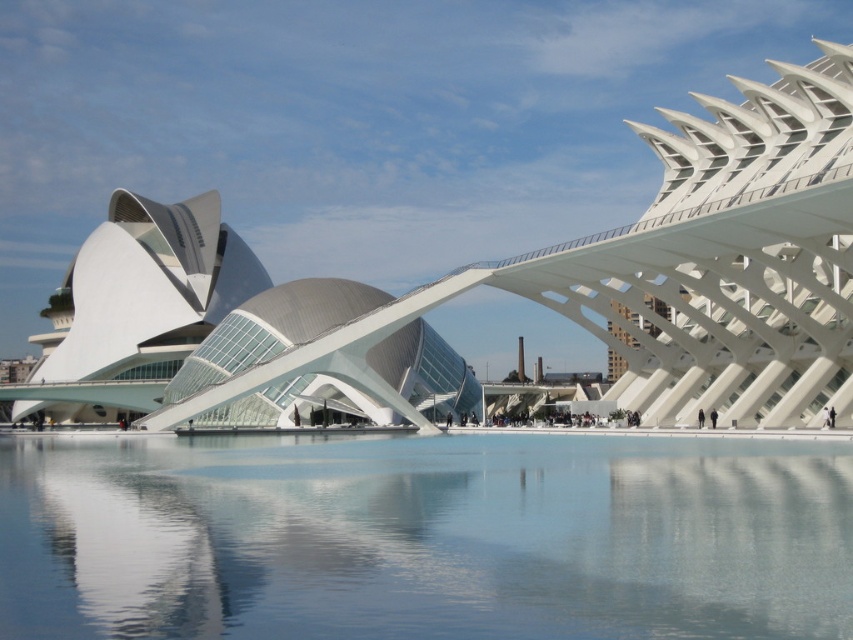
You are standing at the point labeled point (173, 323) and want to walk towards the point labeled point (751, 600). According to the scene description, will you have to go through any obstacles or structures between these two points?

Yes, you will have to go through obstacles or structures between point (173, 323) and point (751, 600) because point (751, 600) is in front of point (173, 323), meaning there is something blocking the direct path between them.

You are an architect analyzing the structural integrity of the scene. Given that the transparent glass water at center is thinner than the white matte building at center, which object might be more prone to structural stress under heavy wind conditions?

The transparent glass water at center is thinner than the white matte building at center, so it might be more prone to structural stress under heavy wind conditions due to its thinner structure.

You are an architect evaluating the structural integrity of the transparent glass water at center and the white matte building at center. Which object has a greater height?

The white matte building at center is taller than the transparent glass water at center, so it has a greater height.